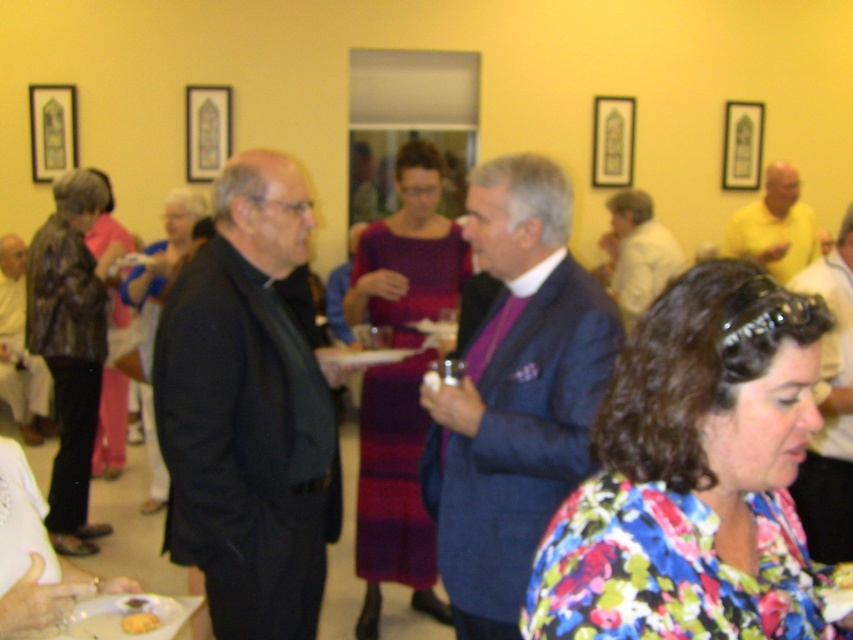
Measure the distance between matte black suit at left and pink fabric dress at left.

matte black suit at left is 3.55 feet from pink fabric dress at left.

Describe the element at coordinates (20, 349) in the screenshot. The height and width of the screenshot is (640, 853). I see `matte black suit at left` at that location.

Where is `matte black suit at left`? The image size is (853, 640). matte black suit at left is located at coordinates (20, 349).

The image size is (853, 640). What are the coordinates of `matte black suit at left` in the screenshot? It's located at (20, 349).

This screenshot has width=853, height=640. What do you see at coordinates (155, 317) in the screenshot?
I see `matte black dress at left` at bounding box center [155, 317].

Identify the location of matte black dress at left. (155, 317).

What do you see at coordinates (694, 476) in the screenshot? This screenshot has height=640, width=853. I see `floral fabric blouse at lower right` at bounding box center [694, 476].

In the scene shown: Between floral fabric blouse at lower right and leather jacket at left, which one appears on the left side from the viewer's perspective?

leather jacket at left

Between point (645, 426) and point (84, 349), which one is positioned in front?

Point (645, 426) is more forward.

The image size is (853, 640). Identify the location of floral fabric blouse at lower right. (694, 476).